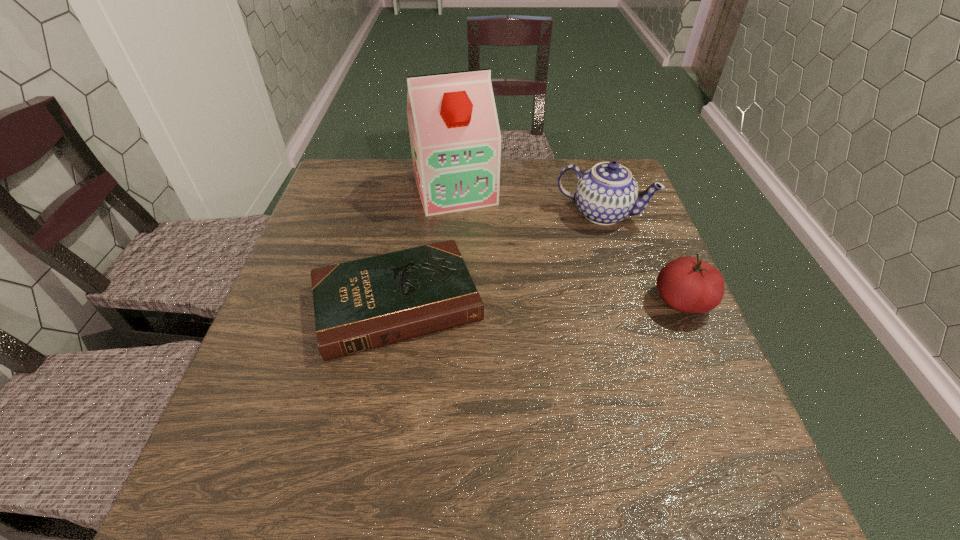
Choose which object is the third nearest neighbor to the tomato. Please provide its 2D coordinates. Your answer should be formatted as a tuple, i.e. [(x, y)], where the tuple contains the x and y coordinates of a point satisfying the conditions above.

[(455, 137)]

Identify which object is located as the nearest to the soya milk. Please provide its 2D coordinates. Your answer should be formatted as a tuple, i.e. [(x, y)], where the tuple contains the x and y coordinates of a point satisfying the conditions above.

[(607, 193)]

Find the location of `free space that satisfies the following two spatial constraints: 1. on the back side of the shortest object; 2. on the right side of the tomato`. free space that satisfies the following two spatial constraints: 1. on the back side of the shortest object; 2. on the right side of the tomato is located at coordinates (396, 302).

You are a GUI agent. You are given a task and a screenshot of the screen. Output one action in this format:
    pyautogui.click(x=<x>, y=<y>)
    Task: Click on the vacant space that satisfies the following two spatial constraints: 1. on the front side of the tomato; 2. on the right side of the chinaware
    
    Given the screenshot: What is the action you would take?
    pyautogui.click(x=630, y=302)

At what (x,y) coordinates should I click in order to perform the action: click on free space that satisfies the following two spatial constraints: 1. on the back side of the chinaware; 2. on the left side of the shortest object. Please return your answer as a coordinate pair (x, y). The width and height of the screenshot is (960, 540). Looking at the image, I should click on (413, 214).